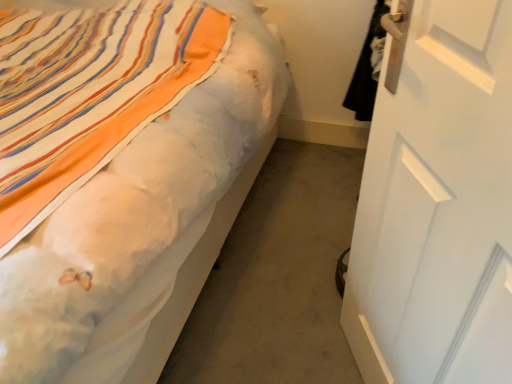
Question: Should I look upward or downward to see white matte door at right?

Choices:
 (A) up
 (B) down

Answer: (B)

Question: Is matte white bed at center turned away from white matte door at right?

Choices:
 (A) yes
 (B) no

Answer: (B)

Question: Is the surface of matte white bed at center in direct contact with white matte door at right?

Choices:
 (A) yes
 (B) no

Answer: (B)

Question: Is the depth of matte white bed at center greater than that of white matte door at right?

Choices:
 (A) yes
 (B) no

Answer: (A)

Question: Does matte white bed at center have a lesser width compared to white matte door at right?

Choices:
 (A) no
 (B) yes

Answer: (A)

Question: Considering the relative sizes of matte white bed at center and white matte door at right in the image provided, is matte white bed at center shorter than white matte door at right?

Choices:
 (A) yes
 (B) no

Answer: (A)

Question: From the image's perspective, is matte white bed at center on top of white matte door at right?

Choices:
 (A) no
 (B) yes

Answer: (B)

Question: Is white matte door at right not near matte white bed at center?

Choices:
 (A) no
 (B) yes

Answer: (A)

Question: Can you confirm if white matte door at right is shorter than matte white bed at center?

Choices:
 (A) no
 (B) yes

Answer: (A)

Question: Is white matte door at right to the right of matte white bed at center from the viewer's perspective?

Choices:
 (A) yes
 (B) no

Answer: (A)

Question: Does white matte door at right have a greater height compared to matte white bed at center?

Choices:
 (A) no
 (B) yes

Answer: (B)

Question: Is white matte door at right bigger than matte white bed at center?

Choices:
 (A) no
 (B) yes

Answer: (A)

Question: Does white matte door at right have a greater width compared to matte white bed at center?

Choices:
 (A) yes
 (B) no

Answer: (B)

Question: From a real-world perspective, is matte white bed at center physically located above or below white matte door at right?

Choices:
 (A) above
 (B) below

Answer: (B)